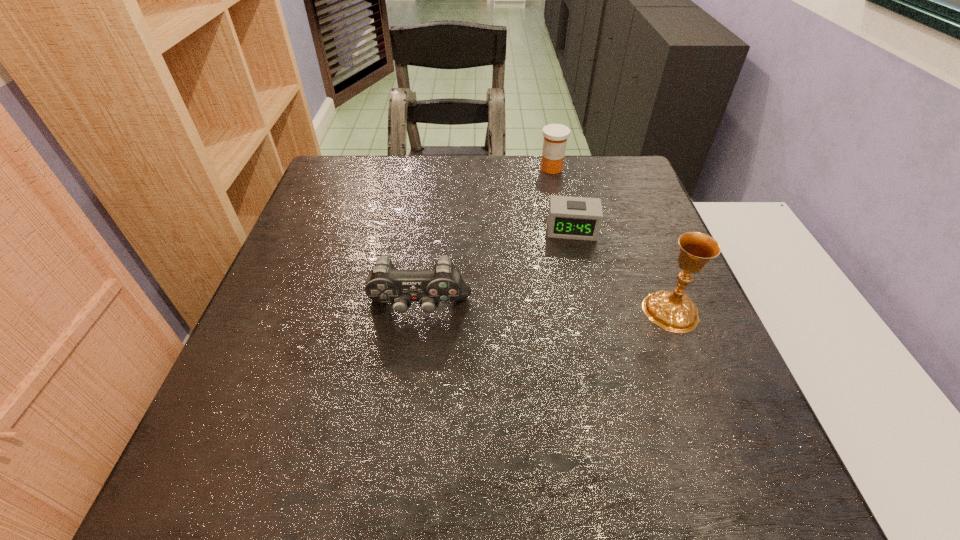
Where is `free spot on the desktop that is between the control and the rightmost object and is positioned on the front-facing side of the alarm clock`? This screenshot has height=540, width=960. free spot on the desktop that is between the control and the rightmost object and is positioned on the front-facing side of the alarm clock is located at coordinates (576, 310).

Locate an element on the screen. free spot on the desktop that is between the leftmost object and the chalice and is positioned on the label of the medicine is located at coordinates (570, 310).